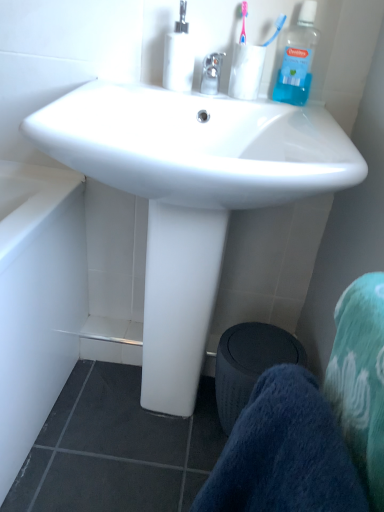
In order to click on vacant space situated on the left part of clear glass faucet at center in this screenshot , I will do `click(136, 83)`.